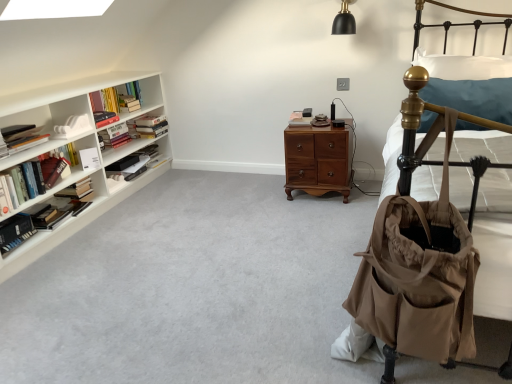
Measure the distance between point (19, 227) and camera.

Point (19, 227) and camera are 7.65 feet apart.

Image resolution: width=512 pixels, height=384 pixels. Describe the element at coordinates (148, 126) in the screenshot. I see `hardcover books at left, positioned as the second book in right-to-left order` at that location.

Describe the element at coordinates (23, 138) in the screenshot. I see `hardcover book at left, which is the second book in left-to-right order` at that location.

What is the approximate width of hardcover book at left, the 6th book from the left?

The width of hardcover book at left, the 6th book from the left, is 7.21 inches.

The image size is (512, 384). In order to click on brown wood nightstand at center in this screenshot , I will do `click(318, 160)`.

Considering the positions of point (343, 170) and point (138, 102), is point (343, 170) closer or farther from the camera than point (138, 102)?

Point (343, 170) is positioned closer to the camera compared to point (138, 102).

Does brown wood nightstand at center turn towards hardcover book at left, which ranks as the 4th book in right-to-left order?

No, brown wood nightstand at center is not facing towards hardcover book at left, which ranks as the 4th book in right-to-left order.

Is brown wood nightstand at center placed right next to hardcover book at left, which ranks as the 4th book in right-to-left order?

No, brown wood nightstand at center is not with hardcover book at left, which ranks as the 4th book in right-to-left order.

Does hardcover book at left, the 3th book from the right, have a lesser height compared to white wooden bookshelf at left?

Correct, hardcover book at left, the 3th book from the right, is not as tall as white wooden bookshelf at left.

Which object is positioned more to the left, hardcover book at left, the 8th book viewed from the left, or white wooden bookshelf at left?

white wooden bookshelf at left.

From a real-world perspective, is hardcover book at left, the 8th book viewed from the left, located higher than white wooden bookshelf at left?

No.

Is hardcover book at left, the 3th book from the right, situated inside white wooden bookshelf at left or outside?

hardcover book at left, the 3th book from the right, is enclosed within white wooden bookshelf at left.

Could you tell me if hardcover book at left, which ranks as the fifth book in right-to-left order, is turned towards hardcover book at left, the tenth book positioned from the right?

No, hardcover book at left, which ranks as the fifth book in right-to-left order, is not aimed at hardcover book at left, the tenth book positioned from the right.

Is hardcover book at left, which ranks as the fifth book in right-to-left order, situated inside hardcover book at left, marked as the 1th book in a left-to-right arrangement, or outside?

hardcover book at left, which ranks as the fifth book in right-to-left order, is outside hardcover book at left, marked as the 1th book in a left-to-right arrangement.

In terms of height, does hardcover book at left, the 6th book from the left, look taller or shorter compared to hardcover book at left, marked as the 1th book in a left-to-right arrangement?

Clearly, hardcover book at left, the 6th book from the left, is shorter compared to hardcover book at left, marked as the 1th book in a left-to-right arrangement.

From a real-world perspective, does hardcover book at left, which ranks as the fifth book in right-to-left order, stand above hardcover book at left, marked as the 1th book in a left-to-right arrangement?

Correct, in the physical world, hardcover book at left, which ranks as the fifth book in right-to-left order, is higher than hardcover book at left, marked as the 1th book in a left-to-right arrangement.

Could you tell me if hardcover book at left, the 8th book viewed from the left, is facing tan fabric baby carriage at right?

No, hardcover book at left, the 8th book viewed from the left, is not facing towards tan fabric baby carriage at right.

Can you confirm if hardcover book at left, the 8th book viewed from the left, is thinner than tan fabric baby carriage at right?

Incorrect, the width of hardcover book at left, the 8th book viewed from the left, is not less than that of tan fabric baby carriage at right.

Considering the relative sizes of hardcover book at left, the 3th book from the right, and tan fabric baby carriage at right in the image provided, is hardcover book at left, the 3th book from the right, taller than tan fabric baby carriage at right?

No, hardcover book at left, the 3th book from the right, is not taller than tan fabric baby carriage at right.

Is white wooden bookshelf at left facing towards hardcover book at left, the 3th book from the right?

Yes, white wooden bookshelf at left is turned towards hardcover book at left, the 3th book from the right.

Is white wooden bookshelf at left closer to camera compared to hardcover book at left, the 8th book viewed from the left?

That is True.

Can you confirm if white wooden bookshelf at left is positioned to the right of hardcover book at left, the 8th book viewed from the left?

In fact, white wooden bookshelf at left is to the left of hardcover book at left, the 8th book viewed from the left.

Is hardcover book at left, which ranks as the fourth book in left-to-right order, inside or outside of brown wood nightstand at center?

hardcover book at left, which ranks as the fourth book in left-to-right order, cannot be found inside brown wood nightstand at center.

Can you confirm if hardcover book at left, which ranks as the fourth book in left-to-right order, is shorter than brown wood nightstand at center?

Yes.

From the image's perspective, is hardcover book at left, which is counted as the 7th book, starting from the right, on brown wood nightstand at center?

No.

Measure the distance between hardcover book at left, the 6th book from the left, and tan fabric baby carriage at right.

hardcover book at left, the 6th book from the left, and tan fabric baby carriage at right are 8.21 feet apart.

Considering the relative sizes of hardcover book at left, which ranks as the fifth book in right-to-left order, and tan fabric baby carriage at right in the image provided, is hardcover book at left, which ranks as the fifth book in right-to-left order, shorter than tan fabric baby carriage at right?

Yes, hardcover book at left, which ranks as the fifth book in right-to-left order, is shorter than tan fabric baby carriage at right.

From the image's perspective, is hardcover book at left, which ranks as the fifth book in right-to-left order, above tan fabric baby carriage at right?

Yes, from the image's perspective, hardcover book at left, which ranks as the fifth book in right-to-left order, is on top of tan fabric baby carriage at right.

From a real-world perspective, relative to tan fabric baby carriage at right, is hardcover book at left, which ranks as the fifth book in right-to-left order, vertically above or below?

From a real-world perspective, hardcover book at left, which ranks as the fifth book in right-to-left order, is physically above tan fabric baby carriage at right.

From a real-world perspective, starting from the brown wood nightstand at center, which book is the 6th one vertically above it? Please provide its 2D coordinates.

[(128, 103)]

From the image's perspective, which book is the 1st one below the white wooden bookshelf at left? Please provide its 2D coordinates.

[(134, 163)]

From the image, which object appears to be nearer to hardcover book at left, which ranks as the fourth book in left-to-right order, hardcover book at left, the 3th book from the left, or tan fabric baby carriage at right?

The object closer to hardcover book at left, which ranks as the fourth book in left-to-right order, is hardcover book at left, the 3th book from the left.

Which object lies further to the anchor point hardcover book at left, which ranks as the 5th book in left-to-right order, hardcover book at left, which is the 8th book in right-to-left order, or hardcover books at left, positioned as the second book in right-to-left order?

hardcover book at left, which is the 8th book in right-to-left order.

When comparing their distances from hardcover book at left, which is counted as the 7th book, starting from the right, does hardcover book at left, the 6th book from the left, or white wooden bookshelf at left seem closer?

white wooden bookshelf at left is closer to hardcover book at left, which is counted as the 7th book, starting from the right.

From the image, which object appears to be farther from hardcover books at left, placed as the 9th book when sorted from left to right, white wooden bookshelf at left or hardcover book at left, marked as the 1th book in a left-to-right arrangement?

hardcover book at left, marked as the 1th book in a left-to-right arrangement, lies further to hardcover books at left, placed as the 9th book when sorted from left to right, than the other object.

Considering their positions, is hardcover books at left, positioned as the second book in right-to-left order, positioned further to white matte book at center, which is the first book from right to left, than hardcover book at left, which is counted as the 7th book, starting from the right?

The object further to white matte book at center, which is the first book from right to left, is hardcover book at left, which is counted as the 7th book, starting from the right.

Estimate the real-world distances between objects in this image. Which object is closer to hardcover books at left, placed as the 9th book when sorted from left to right, hardcover book at left, which is counted as the 7th book, starting from the right, or tan fabric baby carriage at right?

The object closer to hardcover books at left, placed as the 9th book when sorted from left to right, is hardcover book at left, which is counted as the 7th book, starting from the right.

Looking at the image, which one is located closer to brown wood nightstand at center, hardcover book at left, which is the 8th book in right-to-left order, or hardcover books at left, placed as the 9th book when sorted from left to right?

hardcover books at left, placed as the 9th book when sorted from left to right, is closer to brown wood nightstand at center.

Which object lies nearer to the anchor point tan fabric baby carriage at right, white wooden bookshelf at left or hardcover book at left, which is counted as the 7th book, starting from the right?

Based on the image, white wooden bookshelf at left appears to be nearer to tan fabric baby carriage at right.

You are a GUI agent. You are given a task and a screenshot of the screen. Output one action in this format:
    pyautogui.click(x=<x>, y=<y>)
    Task: Click on the shelf between tan fabric baby carriage at right and hardcover book at left, the 8th book viewed from the left, in the front-back direction
    The image size is (512, 384).
    Given the screenshot: What is the action you would take?
    pyautogui.click(x=88, y=197)

The image size is (512, 384). Find the location of `nightstand between tan fabric baby carriage at right and hardcover book at left, the 7th book positioned from the left, from front to back`. nightstand between tan fabric baby carriage at right and hardcover book at left, the 7th book positioned from the left, from front to back is located at coordinates (318, 160).

At what (x,y) coordinates should I click in order to perform the action: click on shelf between hardcover book at left, which is counted as the 7th book, starting from the right, and white matte book at center, which is the first book from right to left. Please return your answer as a coordinate pair (x, y). Looking at the image, I should click on (88, 197).

Identify the location of baby carriage between hardcover book at left, which ranks as the fourth book in left-to-right order, and white soft pillow at upper right, in the horizontal direction. (419, 275).